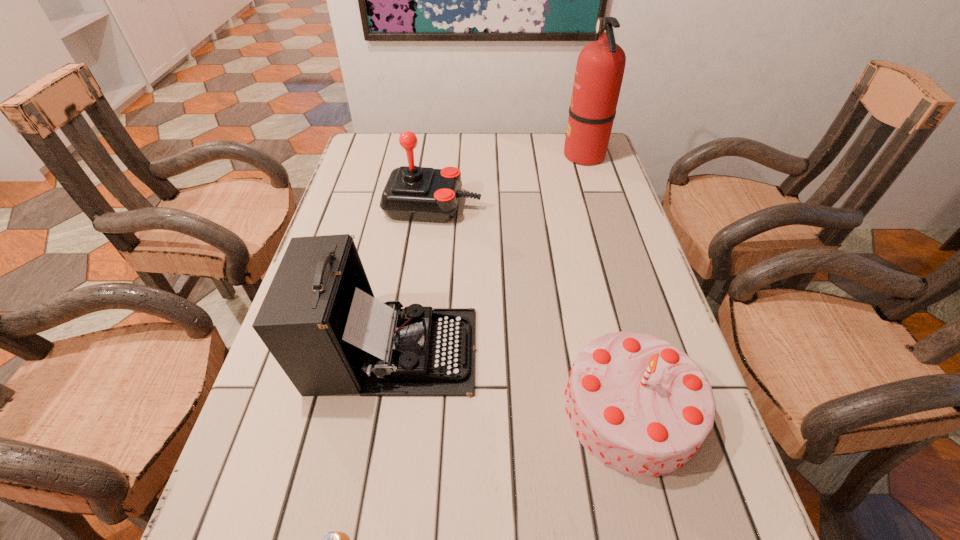
What are the coordinates of `the tallest object` in the screenshot? It's located at (600, 67).

This screenshot has height=540, width=960. I want to click on fire extinguisher, so click(600, 67).

The width and height of the screenshot is (960, 540). Identify the location of typewriter. (320, 320).

What are the coordinates of `joystick` in the screenshot? It's located at (411, 193).

This screenshot has height=540, width=960. Identify the location of birthday cake. (640, 405).

I want to click on vacant space located 0.060m on the side of the tallest object with the nozzle and handle, so click(544, 155).

Where is `vacant space located on the side of the tallest object with the nozzle and handle`? The width and height of the screenshot is (960, 540). vacant space located on the side of the tallest object with the nozzle and handle is located at coordinates (497, 155).

This screenshot has width=960, height=540. In order to click on free space located on the side of the tallest object with the nozzle and handle in this screenshot , I will do pos(469,155).

Locate an element on the screen. The image size is (960, 540). free space located inside the open case of the typewriter is located at coordinates (511, 350).

Where is `vacant region located on the back of the second farthest object`? Image resolution: width=960 pixels, height=540 pixels. vacant region located on the back of the second farthest object is located at coordinates (438, 163).